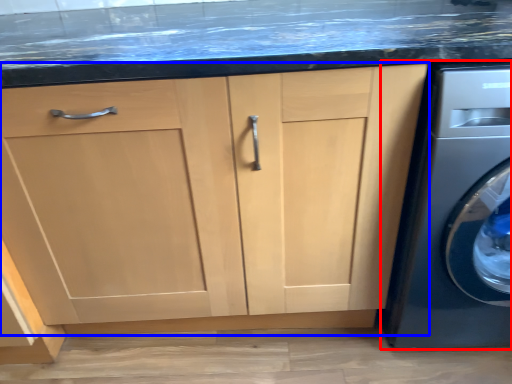
Question: Which point is further to the camera, washing machine (highlighted by a red box) or cabinetry (highlighted by a blue box)?

Choices:
 (A) washing machine
 (B) cabinetry

Answer: (B)